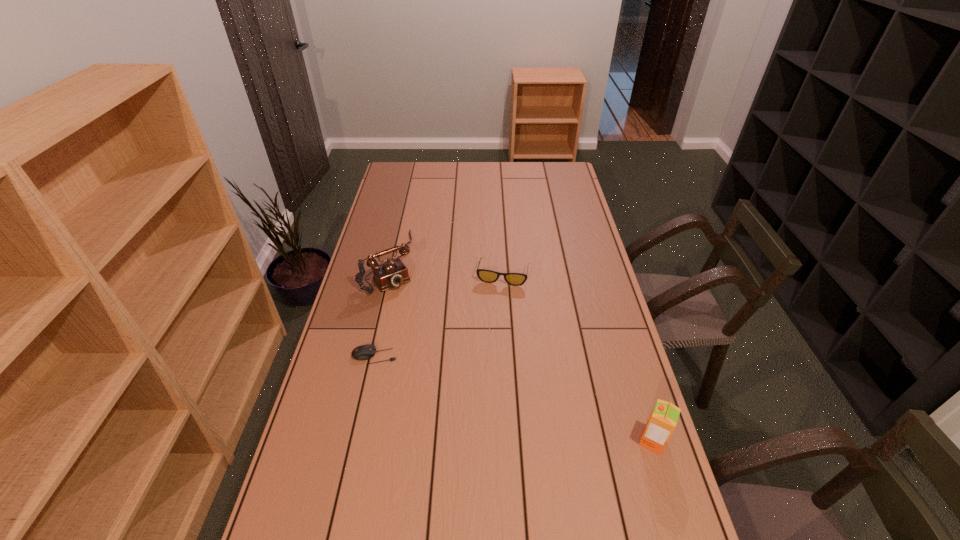
Where is `free space on the desktop that is between the third farthest object and the nearest object and is positioned on the front-facing side of the sunglasses`? free space on the desktop that is between the third farthest object and the nearest object and is positioned on the front-facing side of the sunglasses is located at coordinates (480, 389).

The height and width of the screenshot is (540, 960). What are the coordinates of `free space on the desktop that is between the mouse and the orange juice and is positioned on the dial of the telephone` in the screenshot? It's located at (484, 390).